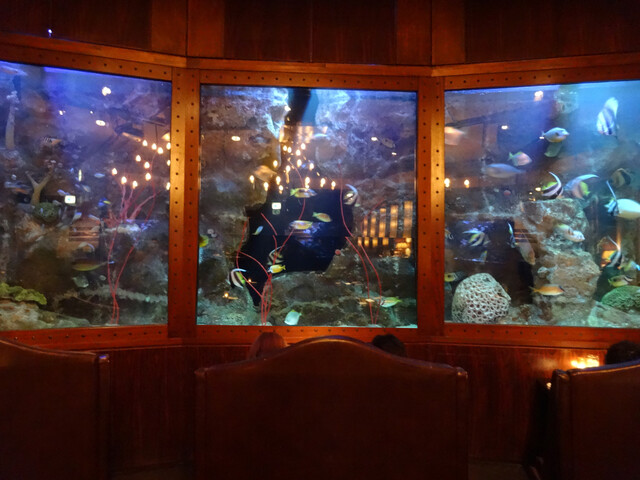
Locate an element on the screen. separators between the windows is located at coordinates (187, 86), (187, 130), (187, 186), (187, 234), (187, 307), (426, 109), (426, 156), (426, 221), (426, 265), (426, 302).